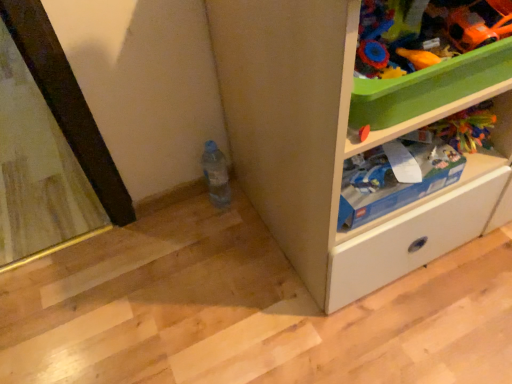
Question: Is orange plastic spoon at upper right, the 2th toy positioned from the right, oriented towards white matte cabinet at lower right?

Choices:
 (A) yes
 (B) no

Answer: (A)

Question: From the image's perspective, is orange plastic spoon at upper right, the 2th toy positioned from the right, located beneath white matte cabinet at lower right?

Choices:
 (A) no
 (B) yes

Answer: (B)

Question: Is orange plastic spoon at upper right, the 2th toy positioned from the right, next to white matte cabinet at lower right?

Choices:
 (A) no
 (B) yes

Answer: (A)

Question: Can you confirm if orange plastic spoon at upper right, the first toy from the left, is bigger than white matte cabinet at lower right?

Choices:
 (A) yes
 (B) no

Answer: (B)

Question: Does orange plastic spoon at upper right, the first toy from the left, appear on the right side of white matte cabinet at lower right?

Choices:
 (A) no
 (B) yes

Answer: (A)

Question: From a real-world perspective, is orange plastic spoon at upper right, the first toy from the left, located beneath white matte cabinet at lower right?

Choices:
 (A) no
 (B) yes

Answer: (A)

Question: Is the position of white matte cabinet at lower right less distant than that of orange plastic spoon at upper right, the first toy from the left?

Choices:
 (A) no
 (B) yes

Answer: (B)

Question: Does white matte cabinet at lower right have a lesser height compared to orange plastic spoon at upper right, the 2th toy positioned from the right?

Choices:
 (A) yes
 (B) no

Answer: (B)

Question: Is white matte cabinet at lower right next to orange plastic spoon at upper right, the first toy from the left, and touching it?

Choices:
 (A) yes
 (B) no

Answer: (B)

Question: Is white matte cabinet at lower right not inside orange plastic spoon at upper right, the first toy from the left?

Choices:
 (A) no
 (B) yes

Answer: (B)

Question: Can you confirm if white matte cabinet at lower right is taller than orange plastic spoon at upper right, the first toy from the left?

Choices:
 (A) yes
 (B) no

Answer: (A)

Question: Are white matte cabinet at lower right and orange plastic spoon at upper right, the first toy from the left, far apart?

Choices:
 (A) yes
 (B) no

Answer: (B)

Question: Considering the relative sizes of blue cardboard box at upper right and white matte cabinet at lower right in the image provided, is blue cardboard box at upper right shorter than white matte cabinet at lower right?

Choices:
 (A) no
 (B) yes

Answer: (B)